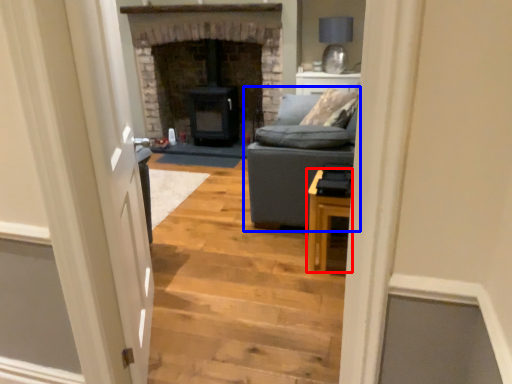
Question: Among these objects, which one is nearest to the camera, table (highlighted by a red box) or studio couch (highlighted by a blue box)?

Choices:
 (A) table
 (B) studio couch

Answer: (A)